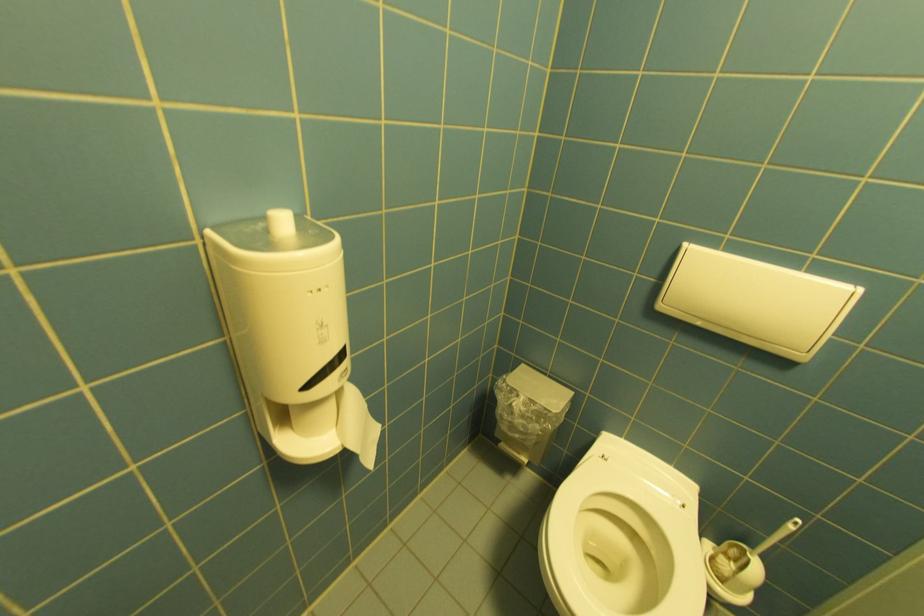
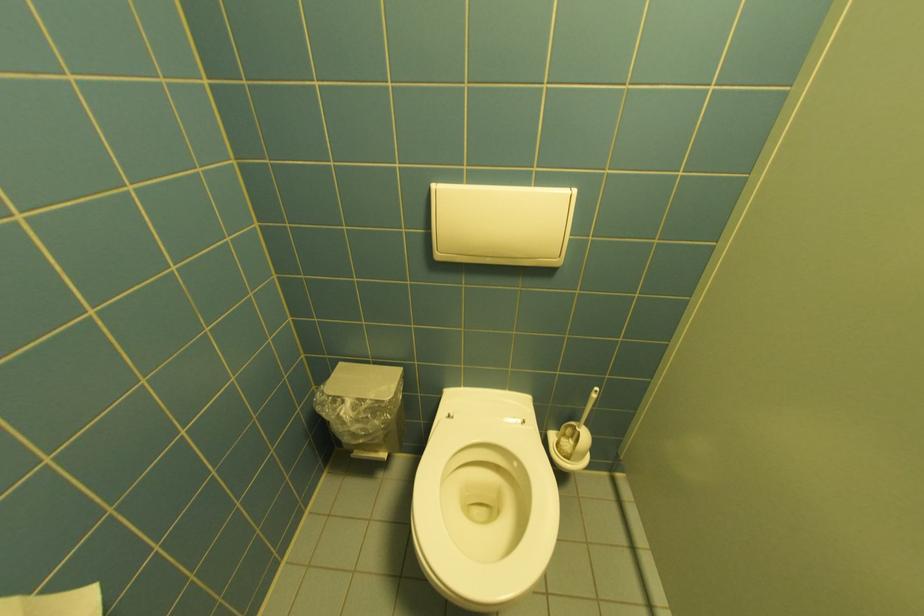
The point at [724,573] is marked in the first image. Where is the corresponding point in the second image?

(570, 455)